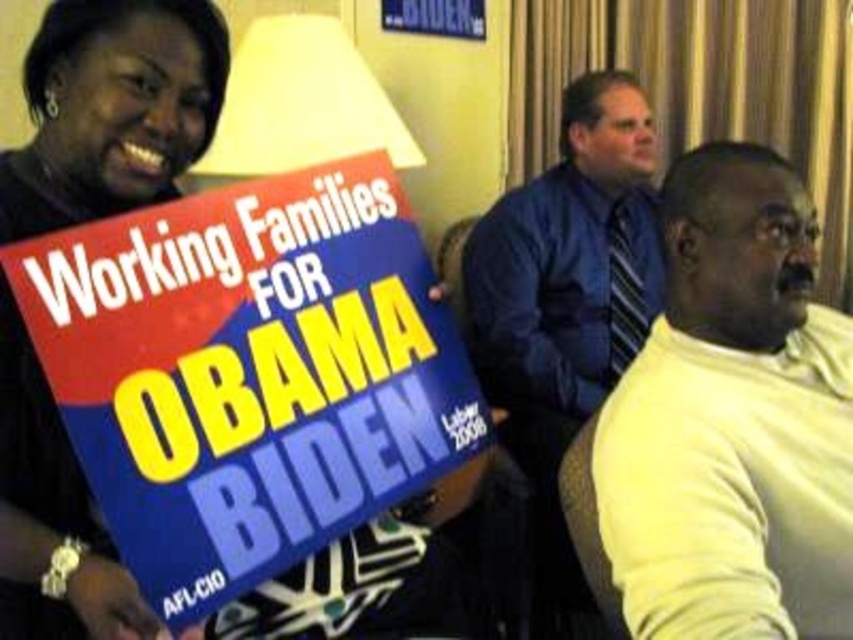
Can you confirm if matte black sign at upper left is wider than blue fabric shirt at center?

In fact, matte black sign at upper left might be narrower than blue fabric shirt at center.

Consider the image. Who is higher up, matte black sign at upper left or blue fabric shirt at center?

Positioned higher is matte black sign at upper left.

Looking at this image, who is more forward, (155,84) or (614,273)?

Point (155,84)

Where is `matte black sign at upper left`? matte black sign at upper left is located at coordinates (112, 109).

Between yellow sweater at right and blue fabric shirt at center, which one appears on the left side from the viewer's perspective?

blue fabric shirt at center is more to the left.

Who is lower down, yellow sweater at right or blue fabric shirt at center?

yellow sweater at right

Does point (697, 451) come behind point (608, 314)?

No, it is not.

The width and height of the screenshot is (853, 640). Find the location of `yellow sweater at right`. yellow sweater at right is located at coordinates (732, 420).

Which is behind, point (675, 451) or point (102, 1)?

Positioned behind is point (675, 451).

Does yellow sweater at right have a greater width compared to matte black sign at upper left?

Indeed, yellow sweater at right has a greater width compared to matte black sign at upper left.

Identify the location of yellow sweater at right. Image resolution: width=853 pixels, height=640 pixels. (732, 420).

Find the location of a particular element. Image resolution: width=853 pixels, height=640 pixels. yellow sweater at right is located at coordinates (732, 420).